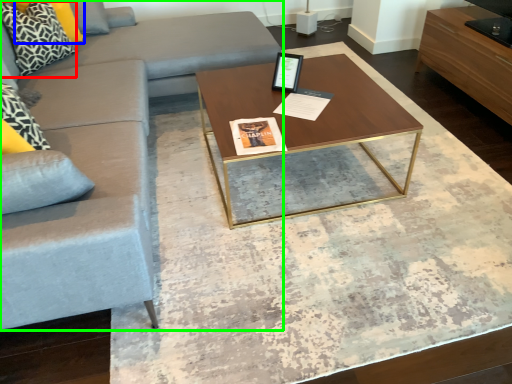
Question: Considering the real-world distances, which object is farthest from pillow (highlighted by a red box)? pillow (highlighted by a blue box) or studio couch (highlighted by a green box)?

Choices:
 (A) pillow
 (B) studio couch

Answer: (B)